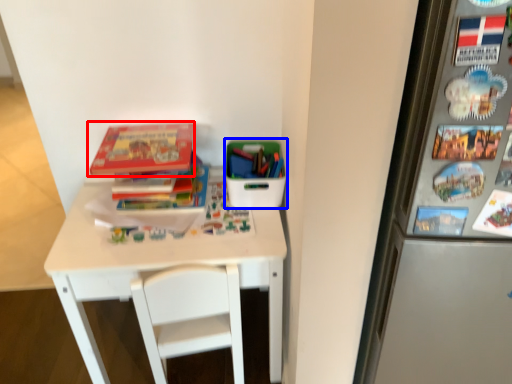
Question: Among these objects, which one is nearest to the camera, book (highlighted by a red box) or box (highlighted by a blue box)?

Choices:
 (A) book
 (B) box

Answer: (A)